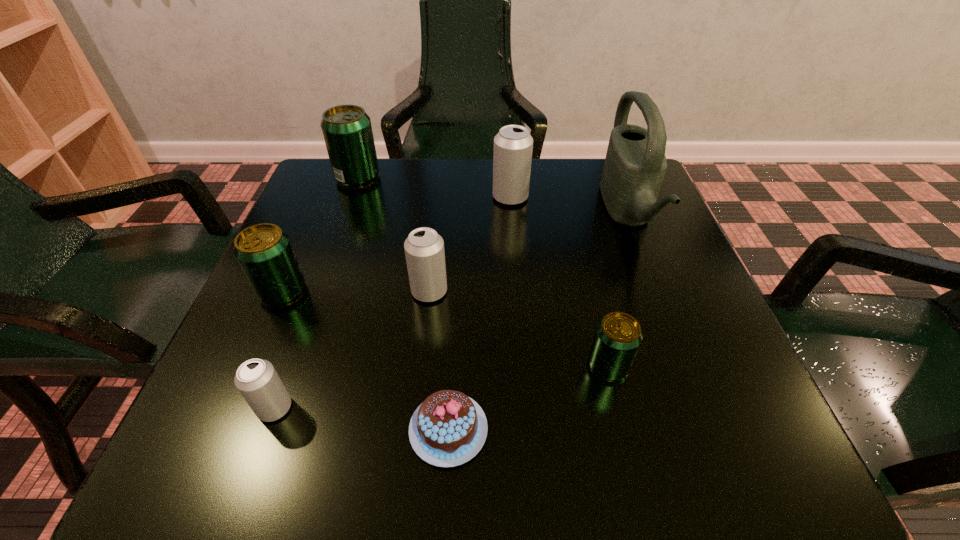
Find the location of a particular element. object that is at the far right corner is located at coordinates (635, 165).

Image resolution: width=960 pixels, height=540 pixels. Find the location of `free space at the far edge of the desktop`. free space at the far edge of the desktop is located at coordinates pos(551,188).

Locate an element on the screen. free space at the near edge of the desktop is located at coordinates (315, 471).

The image size is (960, 540). I want to click on vacant space at the left edge, so click(316, 269).

Identify the location of vacant space at the right edge. (661, 221).

Identify the location of blank space at the far left corner of the desktop. click(323, 211).

I want to click on free space at the near right corner, so click(x=654, y=414).

Where is `free space between the second nearest green beer can and the smallest white beer can`? free space between the second nearest green beer can and the smallest white beer can is located at coordinates (278, 350).

At what (x,y) coordinates should I click in order to perform the action: click on vacant area that lies between the leftmost white beer can and the nearest green beer can. Please return your answer as a coordinate pair (x, y). Image resolution: width=960 pixels, height=540 pixels. Looking at the image, I should click on (442, 387).

Where is `free space between the rightmost beer can and the rightmost object`? This screenshot has width=960, height=540. free space between the rightmost beer can and the rightmost object is located at coordinates (x=617, y=289).